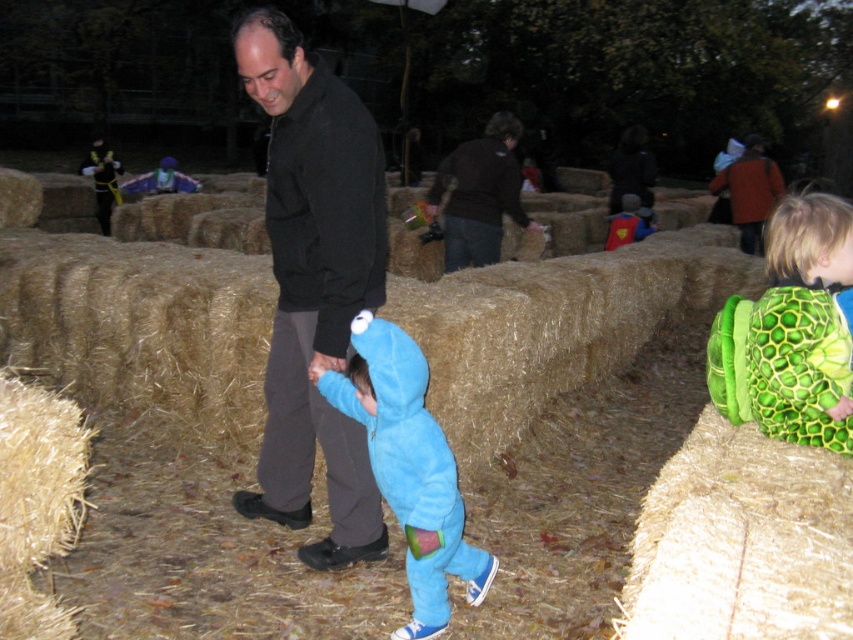
Which is behind, point (383, 486) or point (457, 148)?

The point (457, 148) is behind.

Find the location of `blue fuzzy onesie at center`. blue fuzzy onesie at center is located at coordinates coord(409,468).

Find the location of a particular element. The image size is (853, 640). blue fuzzy onesie at center is located at coordinates (409, 468).

Which is behind, point (314, 244) or point (469, 220)?

Positioned behind is point (469, 220).

Is black soft jacket at center above dark brown leather jacket at upper center?

Actually, black soft jacket at center is below dark brown leather jacket at upper center.

Between point (317, 541) and point (488, 241), which one is positioned in front?

Point (317, 541) is in front.

This screenshot has width=853, height=640. Identify the location of black soft jacket at center. (314, 285).

Based on the photo, is black soft jacket at center smaller than green textured backpack at right?

Actually, black soft jacket at center might be larger than green textured backpack at right.

Is black soft jacket at center positioned before green textured backpack at right?

No, black soft jacket at center is behind green textured backpack at right.

Locate an element on the screen. The width and height of the screenshot is (853, 640). black soft jacket at center is located at coordinates (314, 285).